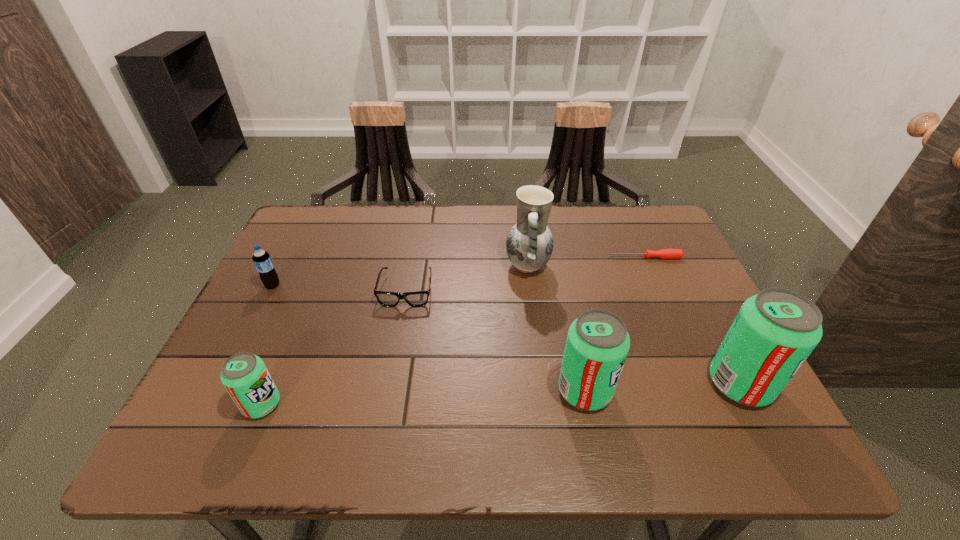
Locate an element on the screen. Image resolution: width=960 pixels, height=540 pixels. free space located 0.090m on the front-facing side of the sixth object from right to left is located at coordinates (325, 404).

The width and height of the screenshot is (960, 540). Find the location of `blank space located 0.280m on the front-facing side of the third soda bottle from left to right`. blank space located 0.280m on the front-facing side of the third soda bottle from left to right is located at coordinates (748, 390).

This screenshot has width=960, height=540. Identify the location of vacant space located on either side of the pottery. (440, 266).

At what (x,y) coordinates should I click in order to perform the action: click on free space located on either side of the pottery. Please return your answer as a coordinate pair (x, y). Looking at the image, I should click on (414, 266).

Where is `free region located 0.310m on either side of the pottery`? The width and height of the screenshot is (960, 540). free region located 0.310m on either side of the pottery is located at coordinates tap(392, 266).

At what (x,y) coordinates should I click in order to perform the action: click on vacant space located 0.090m at the tip of the screwdriver. Please return your answer as a coordinate pair (x, y). Looking at the image, I should click on (578, 258).

Locate an element on the screen. vacant point located at the tip of the screwdriver is located at coordinates (470, 258).

The height and width of the screenshot is (540, 960). In order to click on free space located 0.240m at the tip of the screwdriver in this screenshot , I will do `click(524, 258)`.

The image size is (960, 540). I want to click on free region located on the back of the farthest soda bottle, so click(x=292, y=247).

You are a GUI agent. You are given a task and a screenshot of the screen. Output one action in this format:
    pyautogui.click(x=<x>, y=<y>)
    Task: Click on the vacant region located on the front-facing side of the sixth tallest object
    The image size is (960, 540).
    Given the screenshot: What is the action you would take?
    pyautogui.click(x=395, y=357)